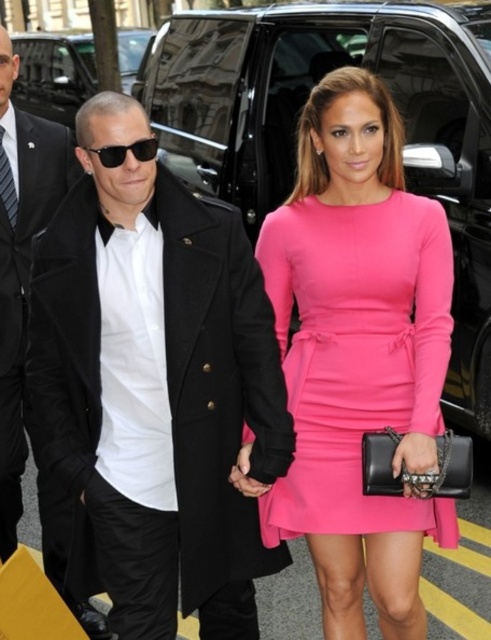
Question: From the image, what is the correct spatial relationship of matte pink dress at center in relation to black wool coat at left?

Choices:
 (A) right
 (B) left

Answer: (A)

Question: Which object is positioned farthest from the black wool coat at left?

Choices:
 (A) matte pink dress at center
 (B) black wool coat at center

Answer: (A)

Question: Which point appears closest to the camera in this image?

Choices:
 (A) (412, 220)
 (B) (107, 113)

Answer: (B)

Question: Does black wool coat at center have a greater width compared to black wool coat at left?

Choices:
 (A) no
 (B) yes

Answer: (B)

Question: Is black wool coat at center to the right of black wool coat at left from the viewer's perspective?

Choices:
 (A) no
 (B) yes

Answer: (B)

Question: Among these points, which one is nearest to the camera?

Choices:
 (A) (124, 506)
 (B) (5, 490)
 (C) (277, 307)

Answer: (A)